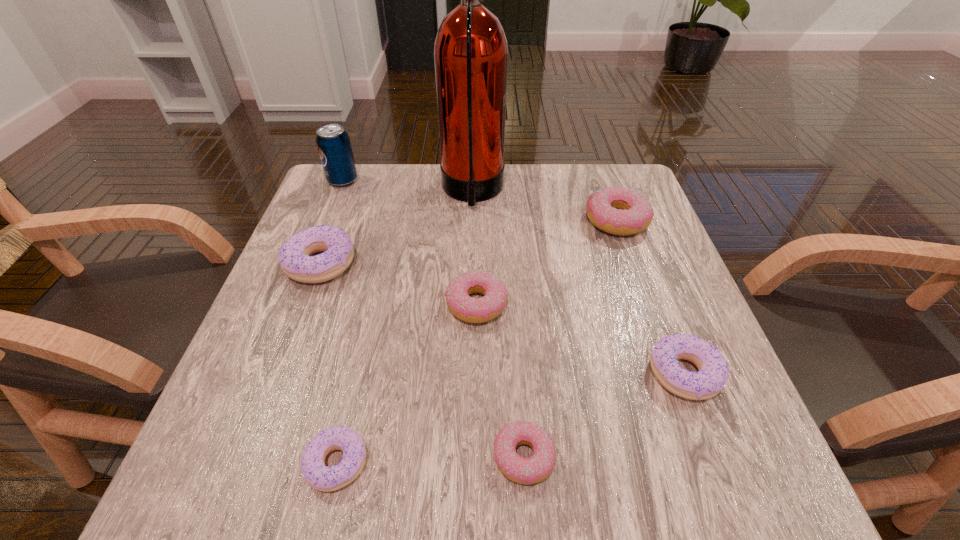
You are a GUI agent. You are given a task and a screenshot of the screen. Output one action in this format:
    pyautogui.click(x=<x>, y=<y>)
    Task: Click on the free space located on the back of the nearest purple doughnut
    
    Given the screenshot: What is the action you would take?
    pyautogui.click(x=366, y=338)

Find the location of a particular element. The width and height of the screenshot is (960, 540). fire extinguisher that is at the far edge is located at coordinates (470, 51).

Identify the location of soda can that is at the far edge. The width and height of the screenshot is (960, 540). (333, 143).

Identify the location of doughnut located in the far edge section of the desktop. This screenshot has height=540, width=960. (622, 211).

Where is `soda can present at the left edge`? This screenshot has height=540, width=960. soda can present at the left edge is located at coordinates [333, 143].

Where is `object present at the far left corner`? This screenshot has width=960, height=540. object present at the far left corner is located at coordinates (333, 143).

Image resolution: width=960 pixels, height=540 pixels. I want to click on object located at the near left corner, so click(320, 477).

At what (x,y) coordinates should I click in order to perform the action: click on object that is at the far right corner. Please return your answer as a coordinate pair (x, y). Looking at the image, I should click on (622, 211).

Locate an element on the screen. Image resolution: width=960 pixels, height=540 pixels. vacant space at the far edge of the desktop is located at coordinates (565, 186).

In order to click on vacant area at the near edge of the desktop in this screenshot , I will do `click(637, 499)`.